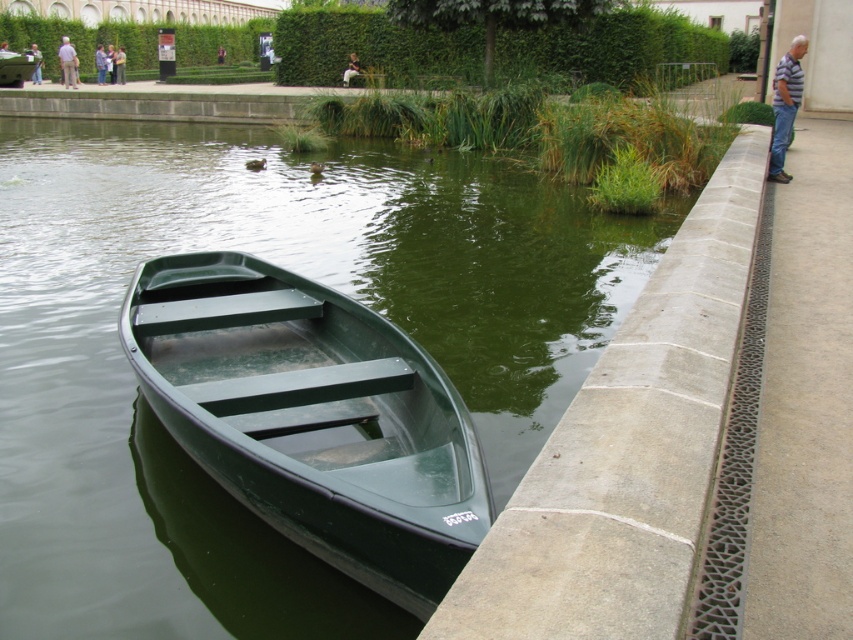
You are standing at the edge of the water and see the green plastic boat at lower left and the striped shirt at right. Which object is closer to your right side?

The striped shirt at right is closer to your right side because it is positioned to the right of the green plastic boat at lower left.

You are standing at the edge of the water body in the scene. If you face the green plastic canoe at center, which direction should you turn to look towards the dark green rowboat?

The dark green rowboat is positioned off to the left side of the frame, so you should turn to your left to face it from the green plastic canoe at center.

You are standing at the center of the image and want to locate the green plastic boat at lower left. Based on the coordinates provided, in which direction should you look to find it?

The green plastic boat at lower left is located at coordinates point (x=293, y=269), so you should look to your lower left direction to find it.